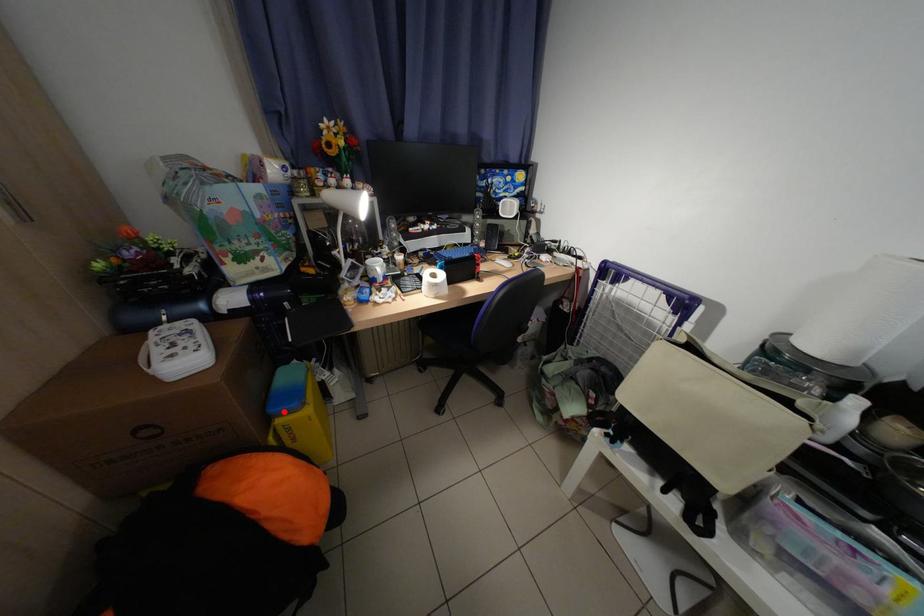
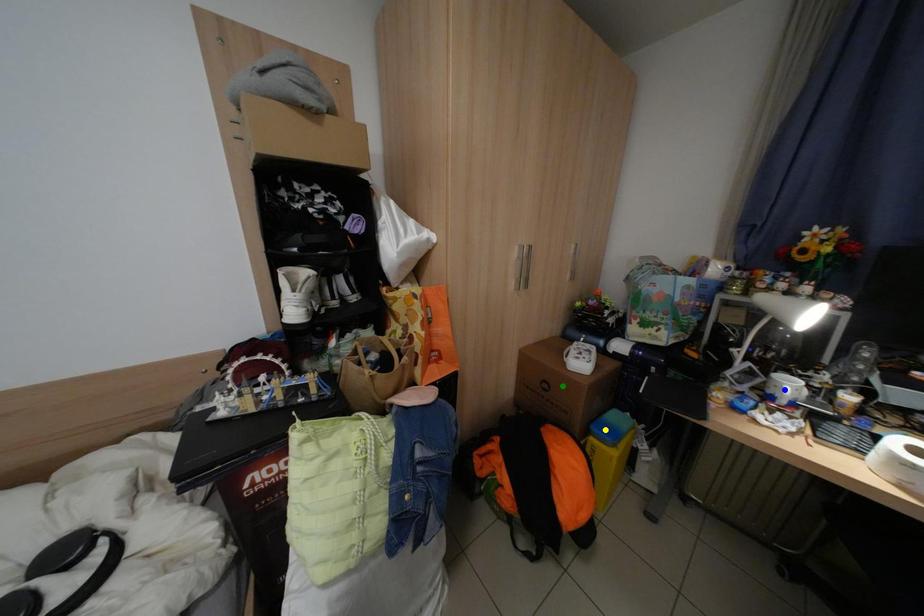
Question: I am providing you with two images of the same scene from different viewpoints. A red point is marked on the first image. You are given multiple points on the second image. Which mark in image 2 goes with the point in image 1?

Choices:
 (A) yellow point
 (B) blue point
 (C) green point

Answer: (A)